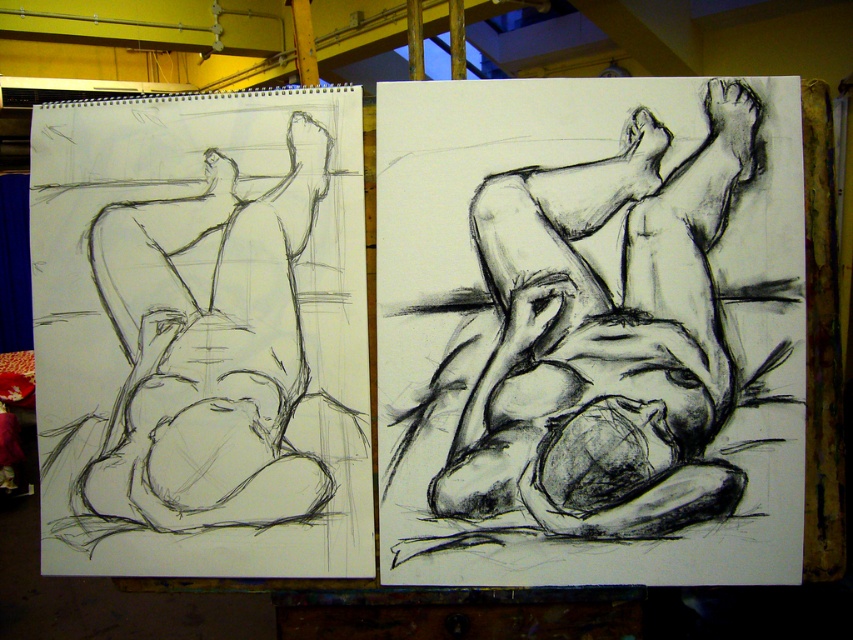
Can you confirm if charcoal sketch of reclining figure at center is positioned above graphite sketch of reclining figure at left?

Indeed, charcoal sketch of reclining figure at center is positioned over graphite sketch of reclining figure at left.

Is charcoal sketch of reclining figure at center to the left of graphite sketch of reclining figure at left from the viewer's perspective?

In fact, charcoal sketch of reclining figure at center is to the right of graphite sketch of reclining figure at left.

Does point (788, 332) come in front of point (96, 464)?

Yes, point (788, 332) is closer to viewer.

The width and height of the screenshot is (853, 640). Find the location of `charcoal sketch of reclining figure at center`. charcoal sketch of reclining figure at center is located at coordinates (590, 332).